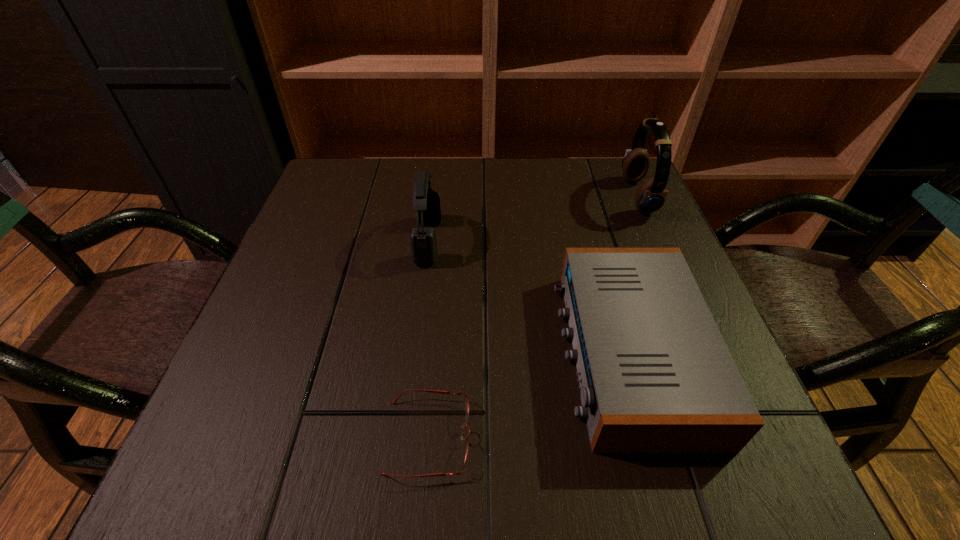
The height and width of the screenshot is (540, 960). What are the coordinates of `object that is at the near right corner` in the screenshot? It's located at (656, 376).

This screenshot has height=540, width=960. I want to click on vacant space at the far edge of the desktop, so click(x=490, y=172).

Locate an element on the screen. The image size is (960, 540). vacant space at the near edge of the desktop is located at coordinates (364, 454).

In the image, there is a desktop. At what (x,y) coordinates should I click in order to perform the action: click on vacant region at the left edge. Please return your answer as a coordinate pair (x, y). Looking at the image, I should click on (231, 428).

Where is `vacant space at the far left corner of the desktop`? vacant space at the far left corner of the desktop is located at coordinates (350, 212).

Locate an element on the screen. The image size is (960, 540). vacant space in between the shorter headset and the third tallest object is located at coordinates (529, 296).

Locate an element on the screen. vacant area that lies between the taller headset and the spectacles is located at coordinates (533, 317).

At what (x,y) coordinates should I click in order to perform the action: click on empty space between the second tallest object and the right headset. Please return your answer as a coordinate pair (x, y). Looking at the image, I should click on (533, 219).

Locate an element on the screen. free space between the spectacles and the taller headset is located at coordinates (533, 317).

Where is `empty space between the shorter headset and the third tallest object`? empty space between the shorter headset and the third tallest object is located at coordinates (529, 296).